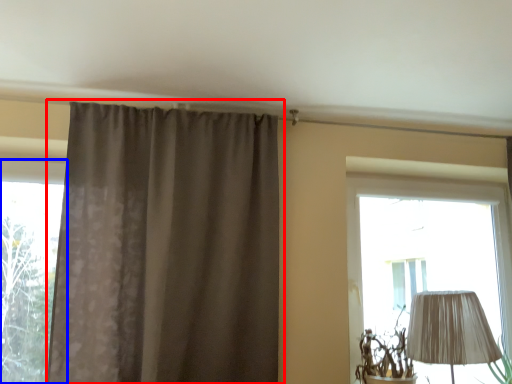
Question: Among these objects, which one is farthest to the camera, curtain (highlighted by a red box) or window (highlighted by a blue box)?

Choices:
 (A) curtain
 (B) window

Answer: (B)